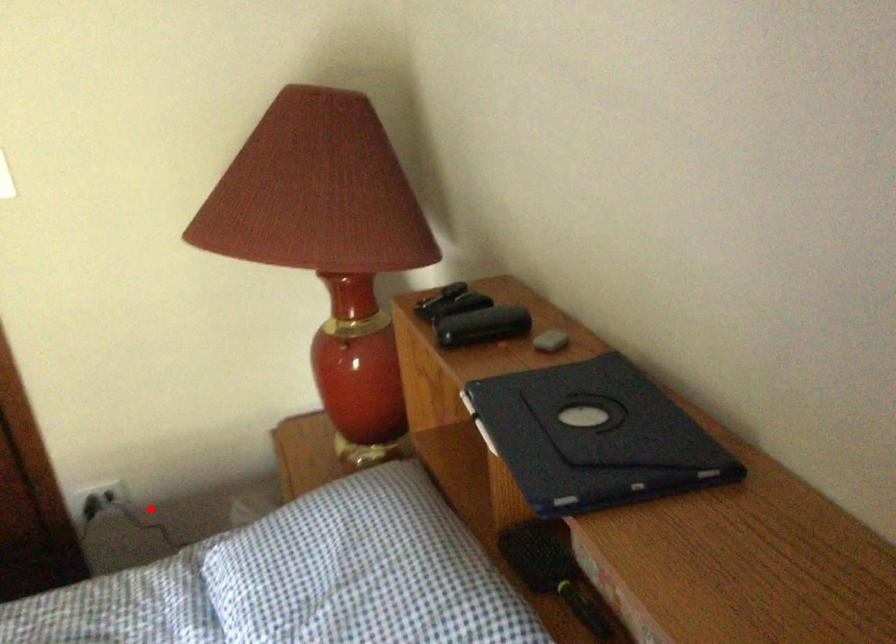
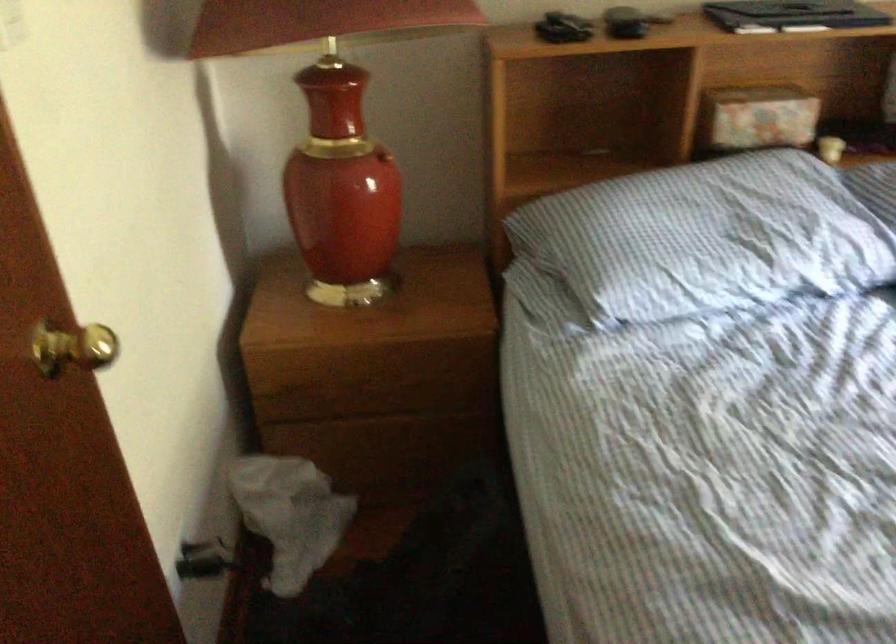
Question: I am providing you with two images of the same scene from different viewpoints. Image1 has a red point marked. In image2, the corresponding 3D location appears at what relative position? Reply with the corresponding letter.

Choices:
 (A) Closer
 (B) Farther

Answer: (A)